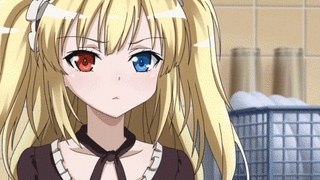
This screenshot has width=320, height=180. In order to click on beige wall tiles in this screenshot , I will do `click(284, 26)`, `click(236, 35)`, `click(265, 73)`.